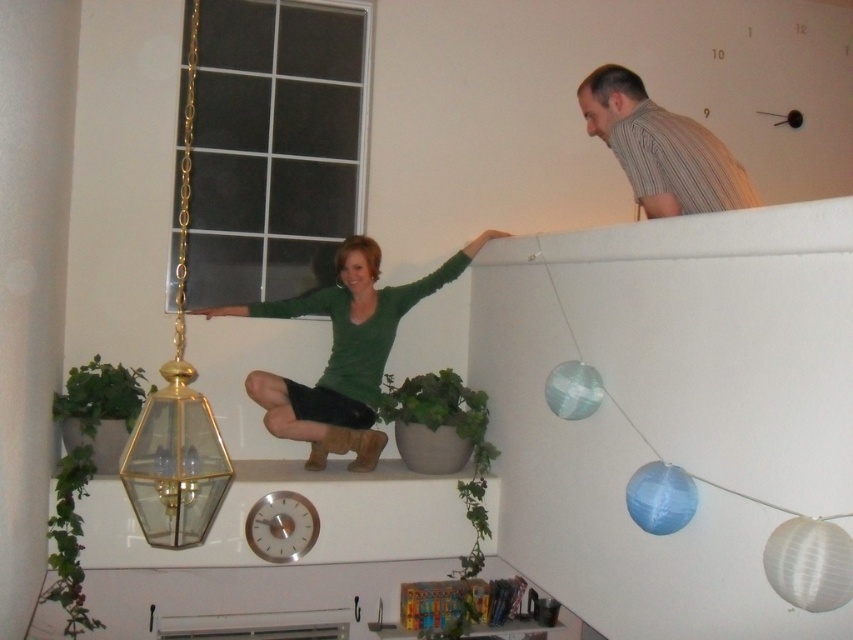
Question: Does gold glass pendant light at upper left have a smaller size compared to striped cotton shirt at upper right?

Choices:
 (A) no
 (B) yes

Answer: (A)

Question: Estimate the real-world distances between objects in this image. Which object is closer to the gold glass pendant light at upper left?

Choices:
 (A) green matte sweater at upper center
 (B) striped cotton shirt at upper right

Answer: (A)

Question: Which of the following is the farthest from the observer?

Choices:
 (A) (337, 445)
 (B) (621, 128)

Answer: (A)

Question: Among these objects, which one is farthest from the camera?

Choices:
 (A) gold glass pendant light at upper left
 (B) striped cotton shirt at upper right
 (C) green matte sweater at upper center

Answer: (C)

Question: Where is green matte sweater at upper center located in relation to striped cotton shirt at upper right in the image?

Choices:
 (A) above
 (B) below

Answer: (B)

Question: Can you confirm if green matte sweater at upper center is positioned to the left of gold glass pendant light at upper left?

Choices:
 (A) no
 (B) yes

Answer: (A)